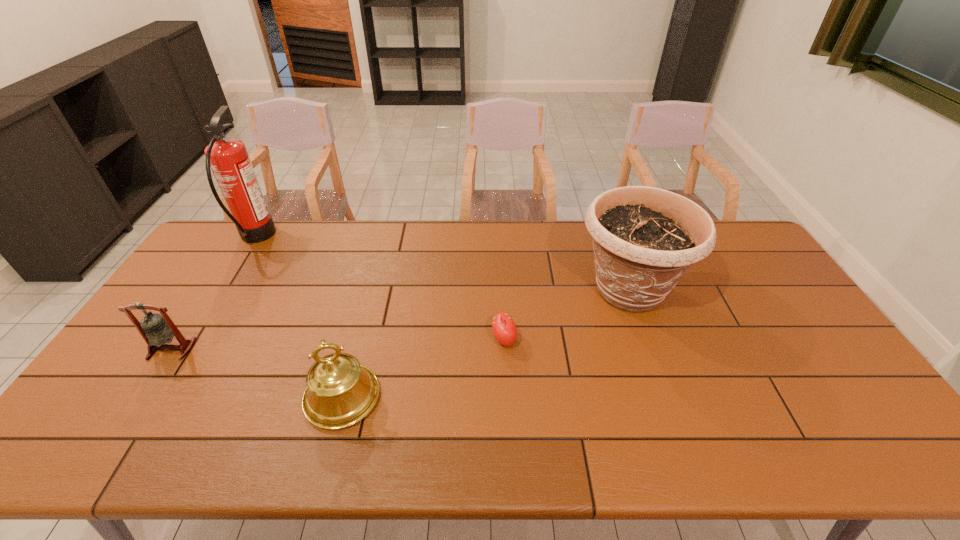
Find the location of `the tallest object`. the tallest object is located at coordinates (228, 158).

This screenshot has width=960, height=540. I want to click on the fourth shortest object, so click(645, 239).

This screenshot has width=960, height=540. In order to click on the rightmost object in this screenshot , I will do `click(645, 239)`.

The width and height of the screenshot is (960, 540). Find the location of `the third object from right to left`. the third object from right to left is located at coordinates (340, 392).

At what (x,y) coordinates should I click in order to perform the action: click on the right bell. Please return your answer as a coordinate pair (x, y). This screenshot has height=540, width=960. Looking at the image, I should click on (340, 392).

Identify the location of the fourth tallest object. This screenshot has height=540, width=960. (156, 330).

The width and height of the screenshot is (960, 540). Identify the location of the farther bell. (156, 330).

Find the location of a particular element. Image resolution: width=960 pixels, height=540 pixels. the fourth object from left to right is located at coordinates (x=504, y=329).

At what (x,y) coordinates should I click in order to perform the action: click on apple. Please return your answer as a coordinate pair (x, y). Looking at the image, I should click on (504, 329).

Locate an element on the screen. The height and width of the screenshot is (540, 960). free location located 0.370m on the front-facing side of the fire extinguisher is located at coordinates (374, 238).